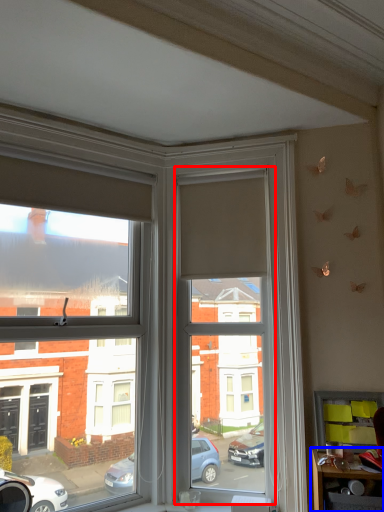
Question: Which object is closer to the camera taking this photo, window screen (highlighted by a red box) or table (highlighted by a blue box)?

Choices:
 (A) window screen
 (B) table

Answer: (B)